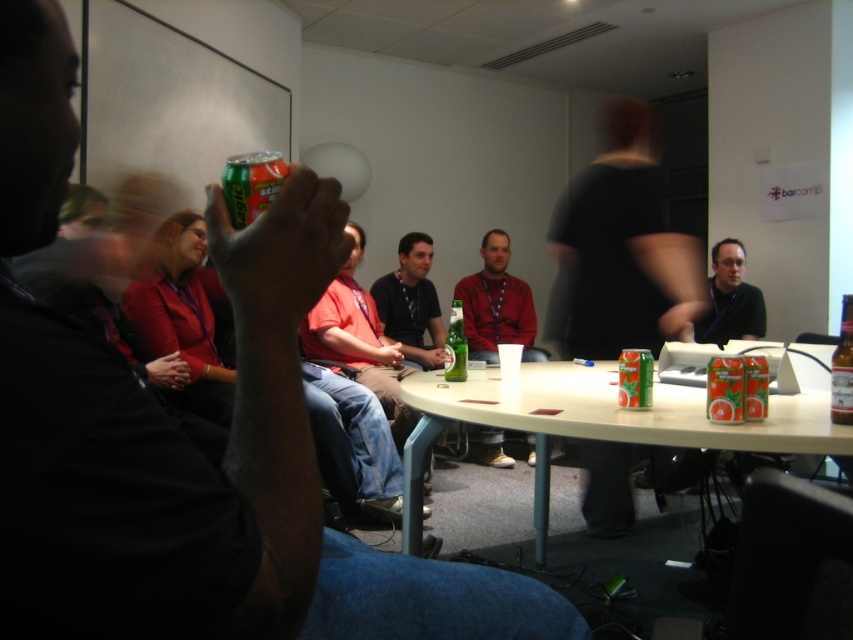
Is matte red shirt at center above green matte can at center?

Yes, matte red shirt at center is above green matte can at center.

At what (x,y) coordinates should I click in order to perform the action: click on matte red shirt at center. Please return your answer as a coordinate pair (x, y). Looking at the image, I should click on (496, 305).

Who is positioned more to the right, white plastic table at center or green matte can at center?

From the viewer's perspective, white plastic table at center appears more on the right side.

Is white plastic table at center thinner than green matte can at center?

In fact, white plastic table at center might be wider than green matte can at center.

The image size is (853, 640). Find the location of `white plastic table at center`. white plastic table at center is located at coordinates (596, 422).

Can you confirm if matte red shirt at center is thinner than matte black shirt at lower right?

No, matte red shirt at center is not thinner than matte black shirt at lower right.

Does point (529, 332) come farther from viewer compared to point (759, 298)?

Yes, it is.

Locate an element on the screen. This screenshot has height=640, width=853. matte red shirt at center is located at coordinates (496, 305).